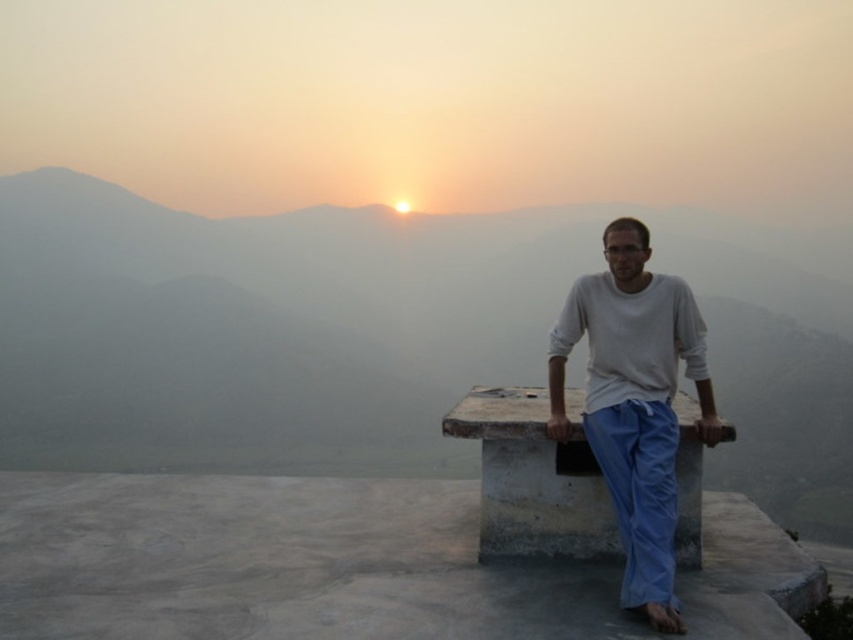
Question: Considering the real-world distances, which object is farthest from the concrete bench at center?

Choices:
 (A) white cotton shirt at center
 (B) gray stone bench at center

Answer: (B)

Question: Can you confirm if gray stone bench at center is positioned to the right of white cotton shirt at center?

Choices:
 (A) yes
 (B) no

Answer: (A)

Question: Which point is farther to the camera?

Choices:
 (A) (637, 512)
 (B) (753, 326)

Answer: (B)

Question: Where is gray stone bench at center located in relation to concrete bench at center in the image?

Choices:
 (A) left
 (B) right

Answer: (B)

Question: Can you confirm if gray stone bench at center is wider than white cotton shirt at center?

Choices:
 (A) yes
 (B) no

Answer: (A)

Question: Which object appears farthest from the camera in this image?

Choices:
 (A) concrete bench at center
 (B) white cotton shirt at center

Answer: (A)